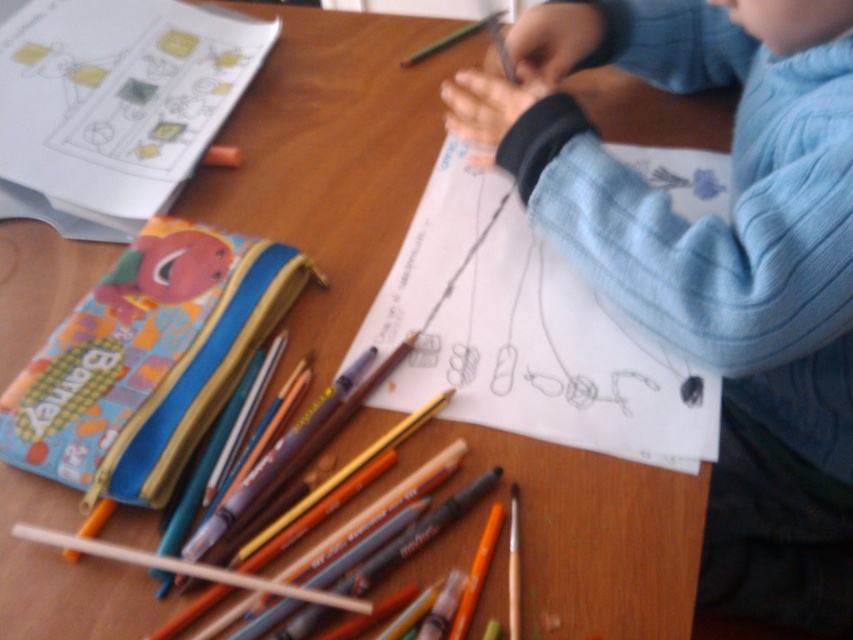
Based on the photo, what is located at the point marked by coordinates (113, 104) in the image?

The point marked by coordinates (113, 104) is white paper at upper left.

You are looking at the scene and want to place a small sticker exactly halfway between the two points, point (624, 301) and point (421, 236). Since the sticker is very small, you can ignore its size. Where should you place it?

The sticker should be placed at the midpoint between point (624, 301) and point (421, 236). To find the midpoint, average the x and y coordinates of both points. The midpoint would be at x coordinate 0.421 and y coordinate 0.6135, so the sticker should be placed at point 0.421, 0.6135.